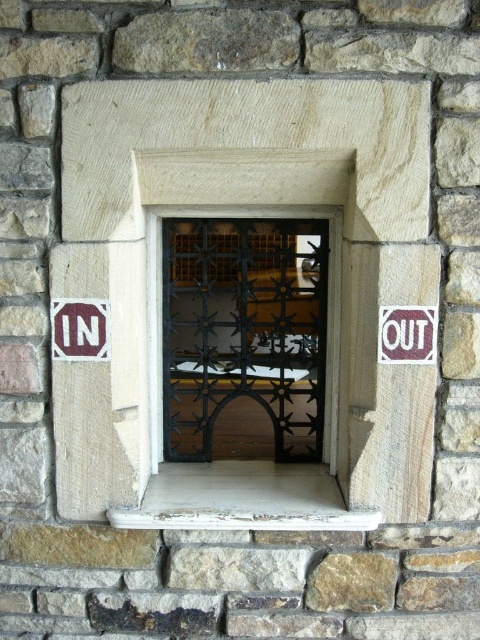
Question: Does maroon plastic sign at right have a greater width compared to white plastic sign at left?

Choices:
 (A) no
 (B) yes

Answer: (B)

Question: Is maroon plastic sign at right thinner than white plastic sign at left?

Choices:
 (A) yes
 (B) no

Answer: (B)

Question: Does maroon plastic sign at right have a lesser width compared to white plastic sign at left?

Choices:
 (A) yes
 (B) no

Answer: (B)